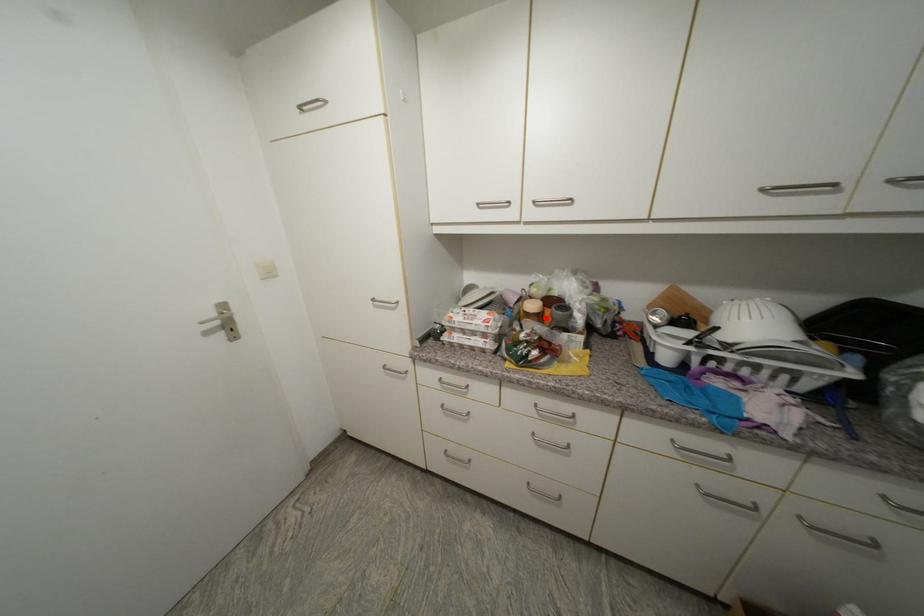
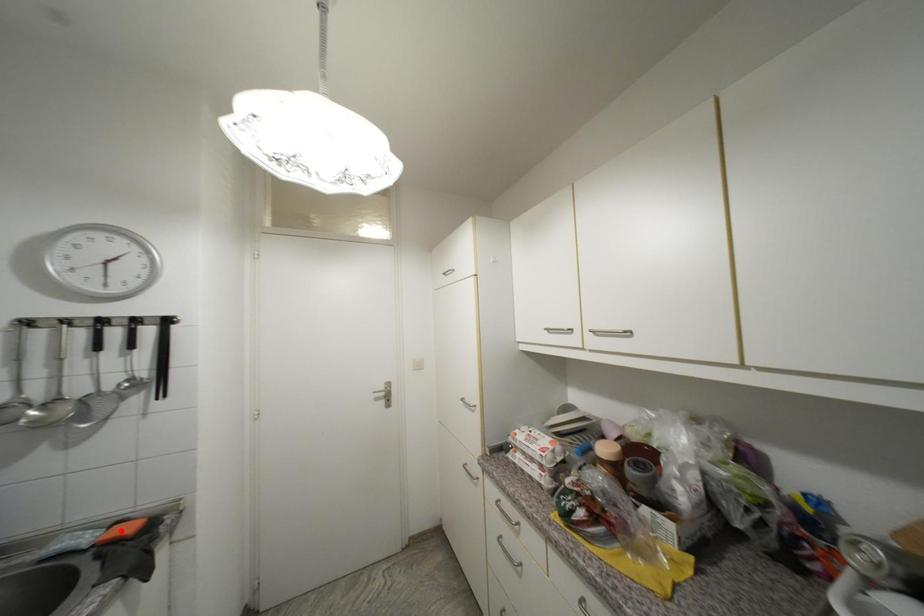
Consider the image. I am providing you with two images of the same scene from different viewpoints. A red point is marked on the first image and another point is marked on the second image. Is the marked point in image1 the same physical position as the marked point in image2?

No